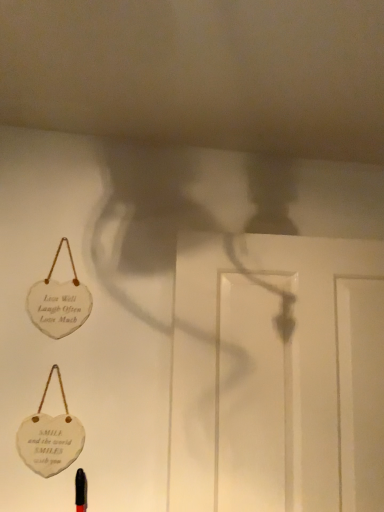
Question: From the image's perspective, is white glossy door at center located above or below white wood heart at upper left?

Choices:
 (A) below
 (B) above

Answer: (A)

Question: Is point (337, 412) closer or farther from the camera than point (77, 321)?

Choices:
 (A) farther
 (B) closer

Answer: (B)

Question: From their relative heights in the image, would you say white glossy door at center is taller or shorter than white wood heart at upper left?

Choices:
 (A) tall
 (B) short

Answer: (A)

Question: From the image's perspective, relative to white glossy door at center, is white wood heart at upper left above or below?

Choices:
 (A) below
 (B) above

Answer: (B)

Question: Is white wood heart at upper left wider or thinner than white glossy door at center?

Choices:
 (A) thin
 (B) wide

Answer: (A)

Question: Looking at the image, does white wood heart at upper left seem bigger or smaller compared to white glossy door at center?

Choices:
 (A) small
 (B) big

Answer: (A)

Question: Relative to white glossy door at center, is white wood heart at upper left in front or behind?

Choices:
 (A) front
 (B) behind

Answer: (B)